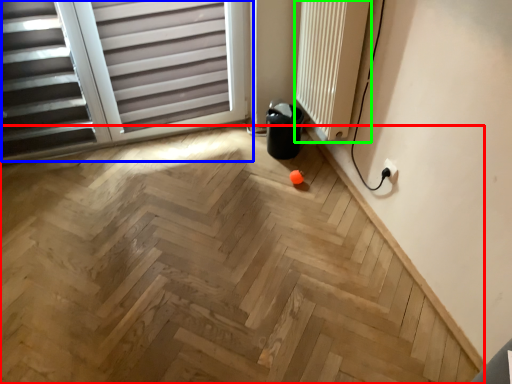
Question: Which is farther away from plywood (highlighted by a red box)? window (highlighted by a blue box) or radiator (highlighted by a green box)?

Choices:
 (A) window
 (B) radiator

Answer: (B)